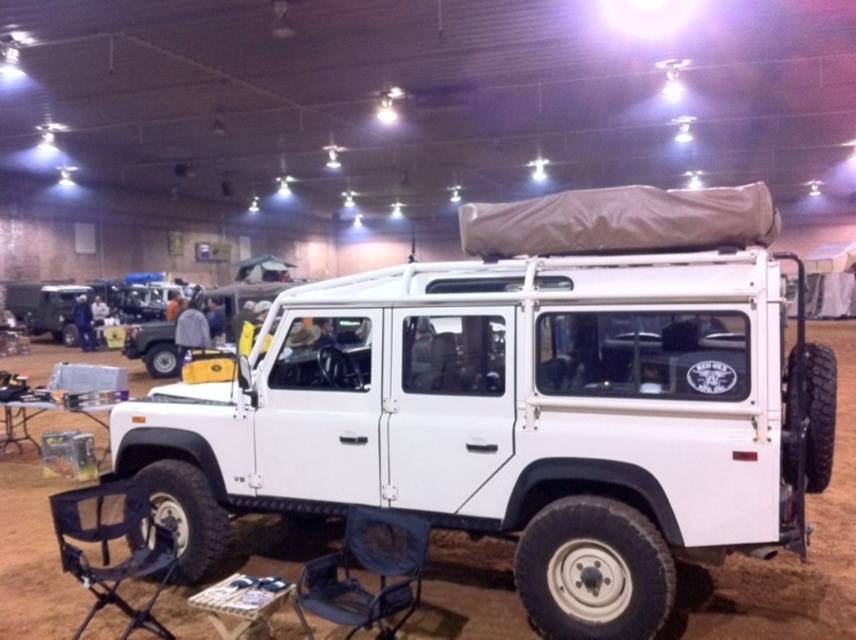
Who is positioned more to the left, gray fabric chair at lower center or black mesh folding chair at lower left?

black mesh folding chair at lower left

Find the location of `gray fabric chair at lower center`. gray fabric chair at lower center is located at coordinates (366, 570).

This screenshot has height=640, width=856. What are the coordinates of `gray fabric chair at lower center` in the screenshot? It's located at (366, 570).

Is white matte suv at center to the left of gray fabric chair at lower center from the viewer's perspective?

No, white matte suv at center is not to the left of gray fabric chair at lower center.

Is white matte suv at center smaller than gray fabric chair at lower center?

No, white matte suv at center is not smaller than gray fabric chair at lower center.

Is point (642, 372) more distant than point (372, 560)?

No.

You are a GUI agent. You are given a task and a screenshot of the screen. Output one action in this format:
    pyautogui.click(x=<x>, y=<y>)
    Task: Click on the white matte suv at center
    
    Given the screenshot: What is the action you would take?
    pyautogui.click(x=526, y=403)

Which is above, white matte suv at center or black mesh folding chair at lower left?

white matte suv at center is higher up.

Can you confirm if white matte suv at center is thinner than black mesh folding chair at lower left?

No.

Does point (752, 333) come closer to viewer compared to point (64, 547)?

Yes, point (752, 333) is closer to viewer.

You are a GUI agent. You are given a task and a screenshot of the screen. Output one action in this format:
    pyautogui.click(x=<x>, y=<y>)
    Task: Click on the white matte suv at center
    This screenshot has width=856, height=640.
    Given the screenshot: What is the action you would take?
    pyautogui.click(x=526, y=403)